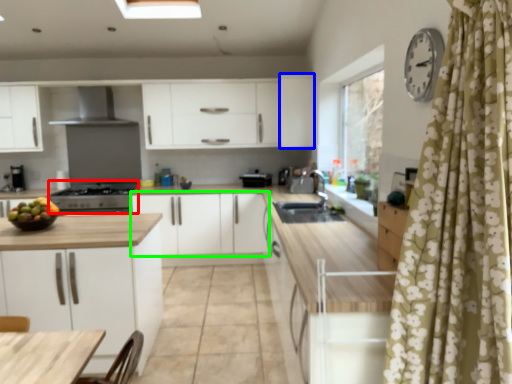
Question: Based on their relative distances, which object is nearer to appliance (highlighted by a red box)? Choose from cabinetry (highlighted by a blue box) and cabinetry (highlighted by a green box).

Choices:
 (A) cabinetry
 (B) cabinetry

Answer: (B)